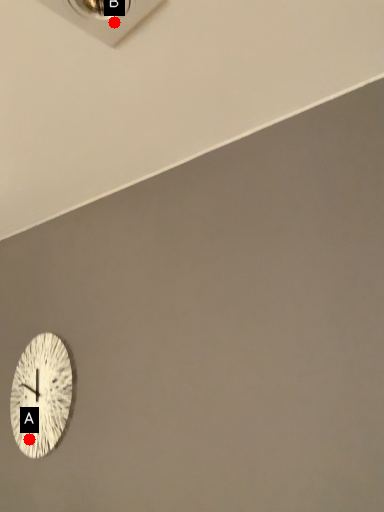
Question: Two points are circled on the image, labeled by A and B beside each circle. Which point is further to the camera?

Choices:
 (A) A is further
 (B) B is further

Answer: (A)